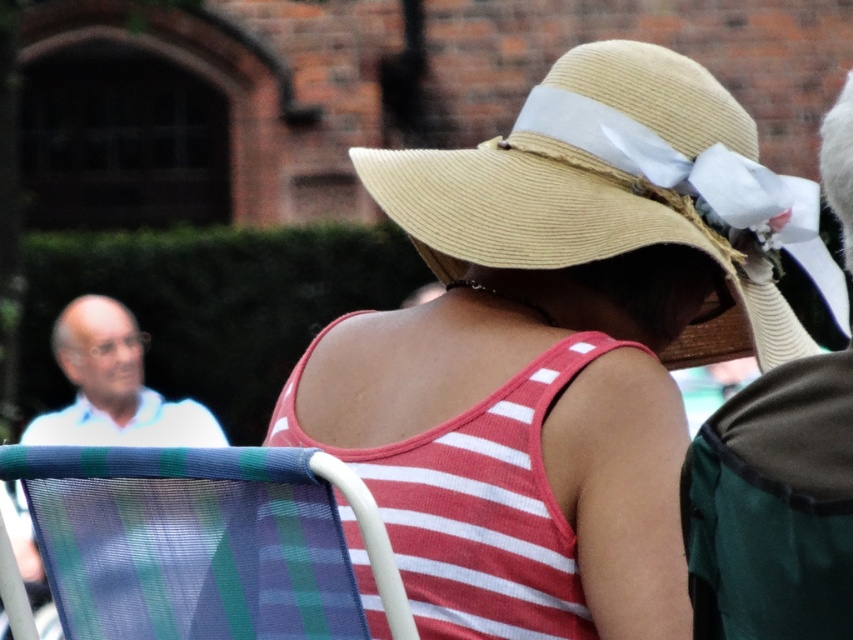
Question: Is natural straw hat at center further to the viewer compared to plaid fabric folding chair at lower left?

Choices:
 (A) no
 (B) yes

Answer: (B)

Question: Considering the real-world distances, which object is farthest from the straw hat at center?

Choices:
 (A) plaid fabric folding chair at lower left
 (B) beige straw hat at upper center
 (C) natural straw hat at center

Answer: (C)

Question: Which point is closer to the camera?

Choices:
 (A) plaid fabric folding chair at lower left
 (B) natural straw hat at center

Answer: (A)

Question: Considering the relative positions of straw hat at center and beige straw hat at upper center in the image provided, where is straw hat at center located with respect to beige straw hat at upper center?

Choices:
 (A) above
 (B) below

Answer: (B)

Question: Can you confirm if straw hat at center is positioned below plaid fabric folding chair at lower left?

Choices:
 (A) no
 (B) yes

Answer: (A)

Question: Considering the real-world distances, which object is farthest from the natural straw hat at center?

Choices:
 (A) plaid fabric folding chair at lower left
 (B) straw hat at center
 (C) beige straw hat at upper center

Answer: (A)